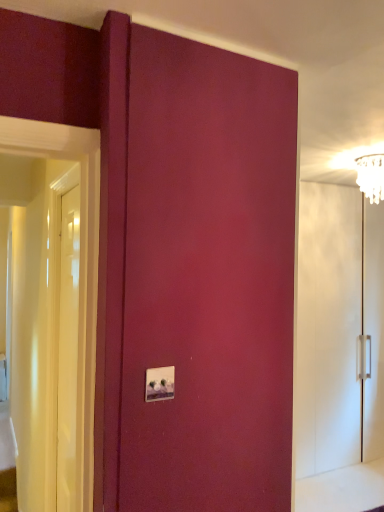
Question: Considering the positions of white glossy door at left and clear glass chandelier at upper right in the image, is white glossy door at left wider or thinner than clear glass chandelier at upper right?

Choices:
 (A) wide
 (B) thin

Answer: (B)

Question: Considering their positions, is white glossy door at left located in front of or behind clear glass chandelier at upper right?

Choices:
 (A) behind
 (B) front

Answer: (B)

Question: Which is farther from the clear glass chandelier at upper right?

Choices:
 (A) white glossy light switch at center
 (B) white glossy door at left
 (C) white glossy cabinet at right

Answer: (A)

Question: Which object is the closest to the white glossy light switch at center?

Choices:
 (A) white glossy door at left
 (B) white glossy cabinet at right
 (C) clear glass chandelier at upper right

Answer: (A)